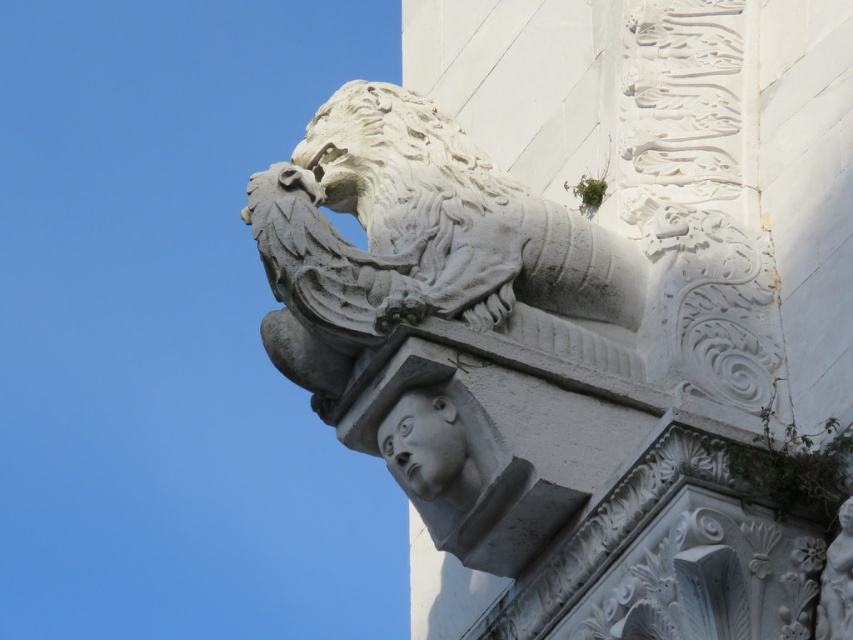
You are an architect examining a historical building. You need to locate the white stone lion at upper center. Where exactly is it positioned in the image?

The white stone lion at upper center is positioned at point (392, 157).

You are an architect examining the stone carving details. You notice a point at coordinates (392, 157). What does this point correspond to in the image?

The point at coordinates (392, 157) corresponds to the white stone lion at upper center.

You are an architect examining the stone carvings. You need to determine the vertical arrangement of the white stone lion at upper center and the gray stone head at center. Which one is positioned higher?

The white stone lion at upper center is positioned higher than the gray stone head at center as it is located above it.